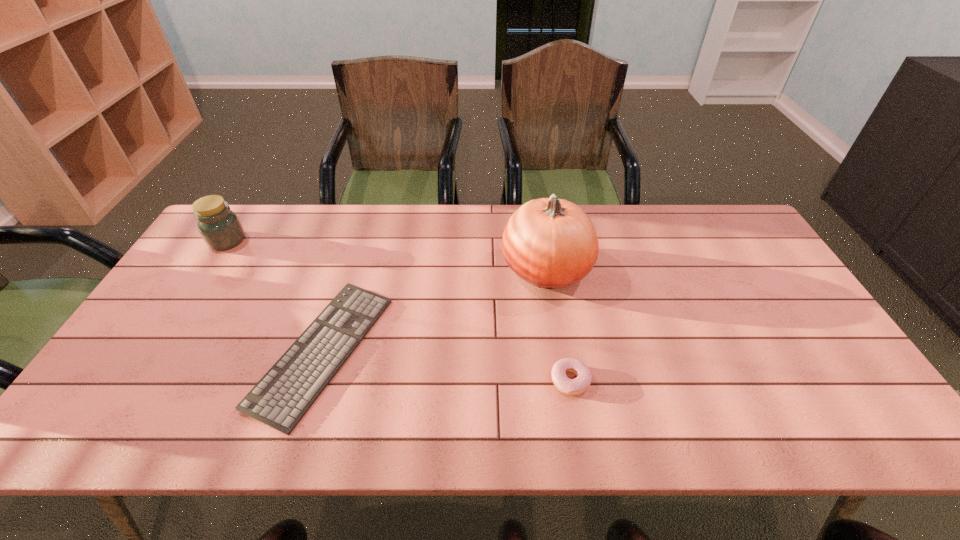
The height and width of the screenshot is (540, 960). What are the coordinates of `pumpkin that is at the far edge` in the screenshot? It's located at (551, 243).

The width and height of the screenshot is (960, 540). Identify the location of jar that is at the far edge. (220, 228).

The width and height of the screenshot is (960, 540). Identify the location of object positioned at the near edge. (281, 398).

Find the location of a particular element. The width and height of the screenshot is (960, 540). object that is at the left edge is located at coordinates [x=220, y=228].

The height and width of the screenshot is (540, 960). In order to click on object present at the far left corner in this screenshot , I will do `click(220, 228)`.

Locate an element on the screen. The height and width of the screenshot is (540, 960). vacant space at the far edge is located at coordinates (406, 228).

Locate an element on the screen. free space at the near edge is located at coordinates (296, 441).

The image size is (960, 540). In the image, there is a desktop. Identify the location of vacant area at the far left corner. (244, 224).

Locate an element on the screen. free location at the far right corner is located at coordinates point(735,233).

This screenshot has height=540, width=960. Identify the location of vacant space that is in between the tallest object and the shortest object. (435, 310).